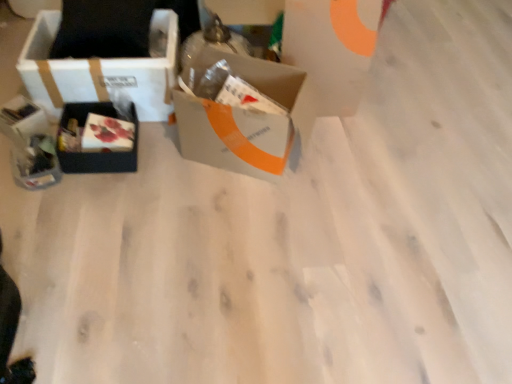
Question: Is white cardboard box at left, positioned as the first box in left-to-right order, at the back of white cardboard box at upper center?

Choices:
 (A) no
 (B) yes

Answer: (A)

Question: Considering the relative sizes of white cardboard box at upper center and white cardboard box at left, the third box when ordered from right to left, in the image provided, is white cardboard box at upper center bigger than white cardboard box at left, the third box when ordered from right to left,?

Choices:
 (A) no
 (B) yes

Answer: (A)

Question: Considering the relative sizes of white cardboard box at upper center and white cardboard box at left, the third box when ordered from right to left, in the image provided, is white cardboard box at upper center wider than white cardboard box at left, the third box when ordered from right to left,?

Choices:
 (A) yes
 (B) no

Answer: (B)

Question: Can you confirm if white cardboard box at upper center is shorter than white cardboard box at left, the third box when ordered from right to left?

Choices:
 (A) yes
 (B) no

Answer: (B)

Question: Is white cardboard box at upper center further to the viewer compared to white cardboard box at left, the third box when ordered from right to left?

Choices:
 (A) no
 (B) yes

Answer: (A)

Question: Is white cardboard box at upper center in front of or behind matte black gift box at left, which ranks as the second gift box in bottom-to-top order, in the image?

Choices:
 (A) front
 (B) behind

Answer: (A)

Question: From the image's perspective, is white cardboard box at upper center positioned above or below matte black gift box at left, the 1th gift box from the top?

Choices:
 (A) above
 (B) below

Answer: (A)

Question: Is white cardboard box at upper center inside the boundaries of matte black gift box at left, the 1th gift box from the top, or outside?

Choices:
 (A) outside
 (B) inside

Answer: (A)

Question: From their relative heights in the image, would you say white cardboard box at upper center is taller or shorter than matte black gift box at left, which ranks as the second gift box in bottom-to-top order?

Choices:
 (A) tall
 (B) short

Answer: (A)

Question: Considering the positions of matte black gift box at left, the second gift box viewed from the top, and matte black box at left, which is counted as the second box, starting from the right, in the image, is matte black gift box at left, the second gift box viewed from the top, wider or thinner than matte black box at left, which is counted as the second box, starting from the right,?

Choices:
 (A) wide
 (B) thin

Answer: (B)

Question: Is point (31, 157) positioned closer to the camera than point (62, 122)?

Choices:
 (A) closer
 (B) farther

Answer: (A)

Question: From a real-world perspective, is matte black gift box at left, the second gift box viewed from the top, above or below matte black box at left, which is counted as the second box, starting from the right?

Choices:
 (A) above
 (B) below

Answer: (A)

Question: Relative to matte black box at left, which is counted as the second box, starting from the right, is matte black gift box at left, which ranks as the first gift box in bottom-to-top order, in front or behind?

Choices:
 (A) behind
 (B) front

Answer: (B)

Question: From the image's perspective, is matte black box at left, the second box viewed from the left, positioned above or below matte plastic box at center-left?

Choices:
 (A) below
 (B) above

Answer: (A)

Question: Relative to matte plastic box at center-left, is matte black box at left, the second box viewed from the left, in front or behind?

Choices:
 (A) front
 (B) behind

Answer: (B)